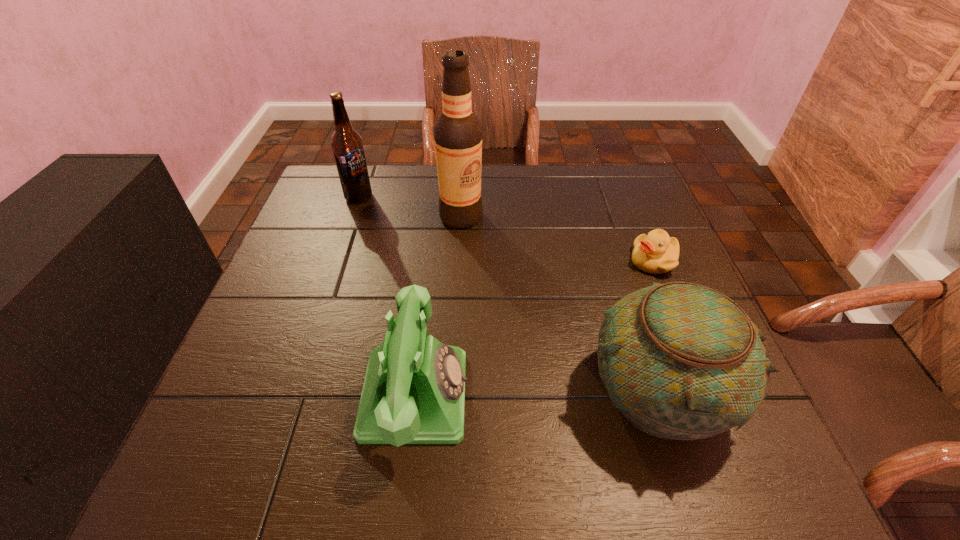
Locate an element on the screen. This screenshot has width=960, height=540. telephone positioned at the near edge is located at coordinates (414, 390).

The height and width of the screenshot is (540, 960). I want to click on pottery positioned at the near edge, so click(679, 360).

Find the location of a particular element. This screenshot has height=540, width=960. object located at the left edge is located at coordinates (346, 143).

This screenshot has height=540, width=960. Find the location of `pottery that is at the right edge`. pottery that is at the right edge is located at coordinates (679, 360).

Image resolution: width=960 pixels, height=540 pixels. What are the coordinates of `duckling present at the right edge` in the screenshot? It's located at (655, 253).

Locate an element on the screen. This screenshot has height=540, width=960. object that is at the far left corner is located at coordinates (346, 143).

Identify the location of object that is at the near right corner. (679, 360).

Locate an element on the screen. The height and width of the screenshot is (540, 960). free space at the far edge of the desktop is located at coordinates (413, 165).

The image size is (960, 540). In the image, there is a desktop. What are the coordinates of `vacant space at the near edge` in the screenshot? It's located at (559, 380).

Locate an element on the screen. The image size is (960, 540). free location at the left edge is located at coordinates (300, 354).